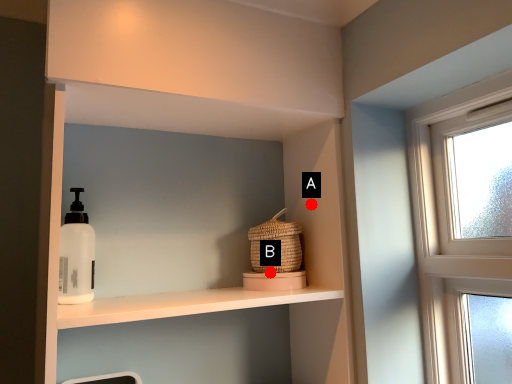
Question: Two points are circled on the image, labeled by A and B beside each circle. Which point is further to the camera?

Choices:
 (A) A is further
 (B) B is further

Answer: (A)